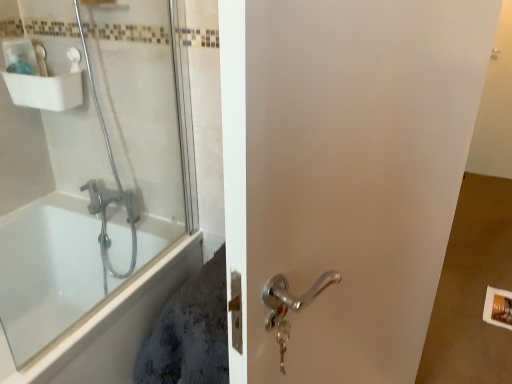
The height and width of the screenshot is (384, 512). Describe the element at coordinates (51, 274) in the screenshot. I see `white glossy bathtub at left` at that location.

Locate an element on the screen. Image resolution: width=512 pixels, height=384 pixels. white glossy bathtub at left is located at coordinates (51, 274).

Identify the location of white glossy bathtub at left. (51, 274).